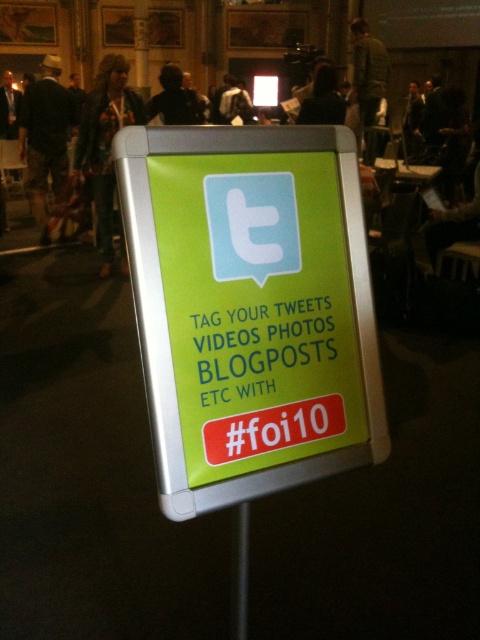
You are at an event and see the green plastic sign at center and the denim shorts at left. Which object is positioned lower in the image?

The green plastic sign at center is located below denim shorts at left, so it is positioned lower in the image.

You are at an event and see the green plastic sign at center. If you were to place a sticker exactly at point (251, 308) on the sign, where would it be located?

The point (251, 308) corresponds to the green plastic sign at center, so placing a sticker there would put it on the sign.

You are standing in front of the signboard at the event. There are two points marked on the signboard. One is at point (45, 147) and the other at point (199, 104). Which point do you see closer to you?

Point (45, 147) is in front of point (199, 104), so you see point (45, 147) closer to you.